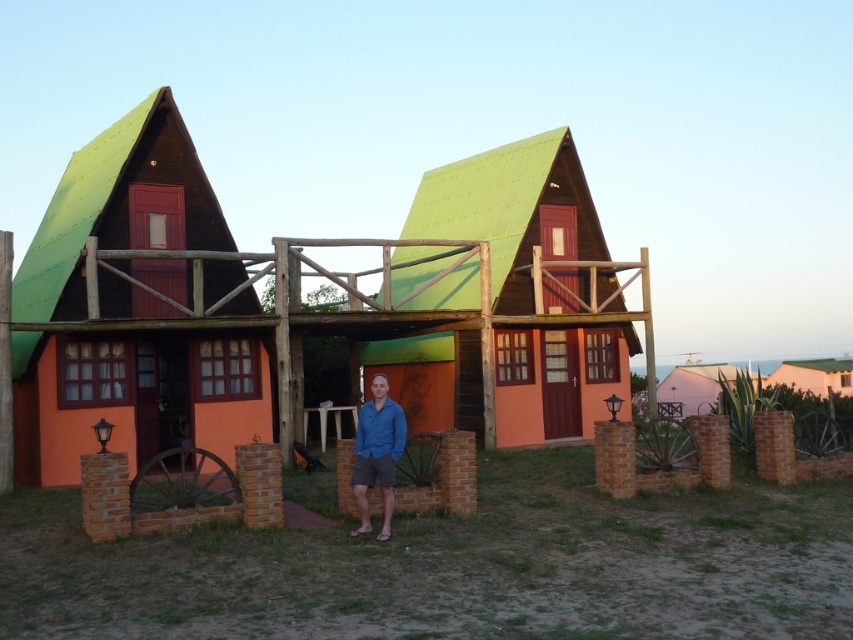
Question: Is matte orange cabin at left behind pink matte house at lower right?

Choices:
 (A) yes
 (B) no

Answer: (B)

Question: Can you confirm if matte orange cabin at left is positioned below white matte hut at lower right?

Choices:
 (A) no
 (B) yes

Answer: (A)

Question: Which point is closer to the camera?

Choices:
 (A) (577, 392)
 (B) (837, 365)
 (C) (679, 368)

Answer: (A)

Question: Which object is positioned closest to the matte orange wood hut at center?

Choices:
 (A) blue cotton shirt at center
 (B) matte orange cabin at left

Answer: (B)

Question: Which object is farther from the camera taking this photo?

Choices:
 (A) white matte hut at lower right
 (B) matte orange cabin at left
 (C) matte orange wood hut at center
 (D) blue cotton shirt at center

Answer: (A)

Question: Does matte orange cabin at left have a greater width compared to pink matte house at lower right?

Choices:
 (A) no
 (B) yes

Answer: (A)